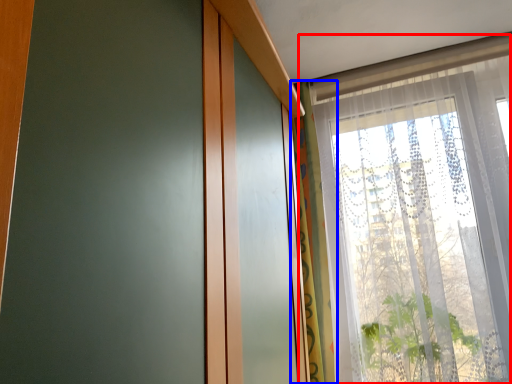
Question: Which object is closer to the camera taking this photo, window (highlighted by a red box) or curtain (highlighted by a blue box)?

Choices:
 (A) window
 (B) curtain

Answer: (A)